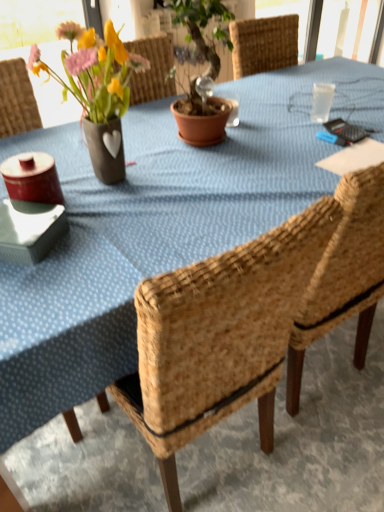
You are a GUI agent. You are given a task and a screenshot of the screen. Output one action in this format:
    pyautogui.click(x=<x>, y=<y>)
    Task: Click on the matte ceramic vase at upper left
    This screenshot has height=512, width=384.
    Given the screenshot: What is the action you would take?
    pyautogui.click(x=96, y=91)

The height and width of the screenshot is (512, 384). Describe the element at coordinates (96, 91) in the screenshot. I see `matte ceramic vase at upper left` at that location.

Describe the element at coordinates (219, 337) in the screenshot. The image size is (384, 512). I see `woven wood chair at center` at that location.

Measure the distance between point (250, 384) and camera.

3.82 feet.

Identify the location of woven wood chair at center. pyautogui.click(x=219, y=337).

The width and height of the screenshot is (384, 512). I want to click on matte ceramic vase at upper left, so click(x=96, y=91).

In the scene shown: Would you say matte ceramic vase at upper left is to the left or to the right of woven wood chair at center in the picture?

In the image, matte ceramic vase at upper left appears on the left side of woven wood chair at center.

Which object is more forward, matte ceramic vase at upper left or woven wood chair at center?

woven wood chair at center is in front.

Which is less distant, (x=125, y=71) or (x=166, y=331)?

Point (x=125, y=71).

From the image's perspective, between matte ceramic vase at upper left and woven wood chair at center, who is located below?

woven wood chair at center appears lower in the image.

Based on the photo, from a real-world perspective, is matte ceramic vase at upper left above or below woven wood chair at center?

Clearly, from a real-world perspective, matte ceramic vase at upper left is above woven wood chair at center.

Looking at their sizes, would you say matte ceramic vase at upper left is wider or thinner than woven wood chair at center?

matte ceramic vase at upper left is thinner than woven wood chair at center.

Is matte ceramic vase at upper left taller or shorter than woven wood chair at center?

Clearly, matte ceramic vase at upper left is shorter compared to woven wood chair at center.

Is matte ceramic vase at upper left smaller than woven wood chair at center?

Yes, matte ceramic vase at upper left is smaller than woven wood chair at center.

Is matte ceramic vase at upper left inside the boundaries of woven wood chair at center, or outside?

matte ceramic vase at upper left is not inside woven wood chair at center, it's outside.

Is matte ceramic vase at upper left not near woven wood chair at center?

No, matte ceramic vase at upper left is in close proximity to woven wood chair at center.

Does matte ceramic vase at upper left turn towards woven wood chair at center?

Yes, matte ceramic vase at upper left is aimed at woven wood chair at center.

How different are the orientations of matte ceramic vase at upper left and woven wood chair at center in degrees?

The angle between the facing direction of matte ceramic vase at upper left and the facing direction of woven wood chair at center is 178 degrees.

I want to click on floral arrangement located above the woven wood chair at center (from the image's perspective), so click(x=96, y=91).

From the picture: Is woven wood chair at center to the left of matte ceramic vase at upper left from the viewer's perspective?

Incorrect, woven wood chair at center is not on the left side of matte ceramic vase at upper left.

From the picture: Is woven wood chair at center closer to the viewer compared to matte ceramic vase at upper left?

Yes, it is in front of matte ceramic vase at upper left.

Does point (185, 442) come behind point (88, 38)?

No.

From the image's perspective, who appears lower, woven wood chair at center or matte ceramic vase at upper left?

woven wood chair at center is shown below in the image.

From a real-world perspective, is woven wood chair at center positioned above or below matte ceramic vase at upper left?

woven wood chair at center is situated lower than matte ceramic vase at upper left in the real world.

Is woven wood chair at center thinner than matte ceramic vase at upper left?

No.

Which of these two, woven wood chair at center or matte ceramic vase at upper left, stands shorter?

Standing shorter between the two is matte ceramic vase at upper left.

Based on their sizes in the image, would you say woven wood chair at center is bigger or smaller than matte ceramic vase at upper left?

woven wood chair at center is bigger than matte ceramic vase at upper left.

Is woven wood chair at center outside of matte ceramic vase at upper left?

woven wood chair at center is positioned outside matte ceramic vase at upper left.

Based on the photo, is there a large distance between woven wood chair at center and matte ceramic vase at upper left?

woven wood chair at center is near matte ceramic vase at upper left, not far away.

Is matte ceramic vase at upper left at the back of woven wood chair at center?

woven wood chair at center is not turned away from matte ceramic vase at upper left.

How different are the orientations of woven wood chair at center and matte ceramic vase at upper left in degrees?

The angle between the facing direction of woven wood chair at center and the facing direction of matte ceramic vase at upper left is 178 degrees.

Locate an element on the screen. This screenshot has height=512, width=384. chair below the matte ceramic vase at upper left (from the image's perspective) is located at coordinates (219, 337).

Find the location of a particular element. The width and height of the screenshot is (384, 512). chair in front of the matte ceramic vase at upper left is located at coordinates (219, 337).

Locate an element on the screen. The image size is (384, 512). chair located below the matte ceramic vase at upper left (from the image's perspective) is located at coordinates (219, 337).